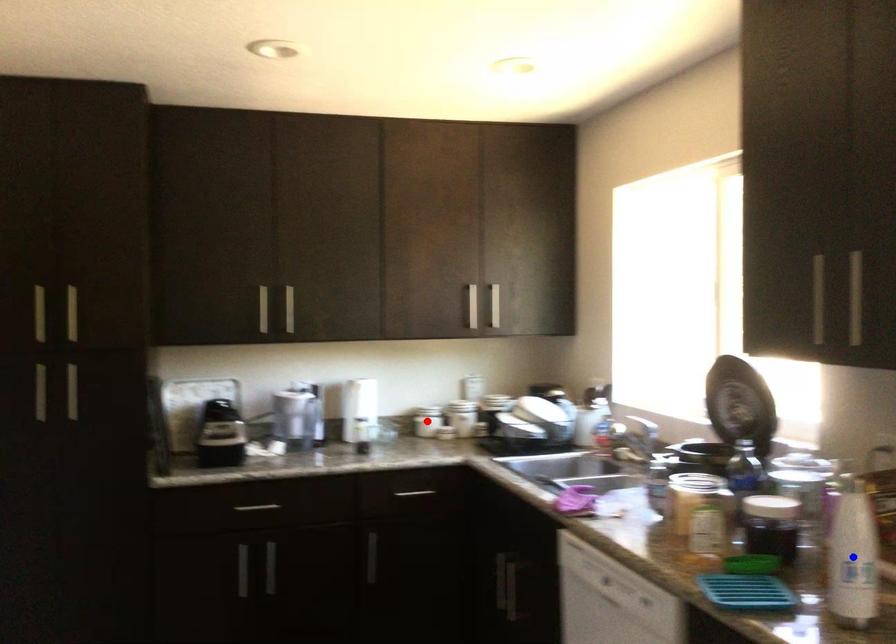
Question: Two points are marked on the image. Which point is closer to the camera?

Choices:
 (A) Blue point is closer.
 (B) Red point is closer.

Answer: (A)